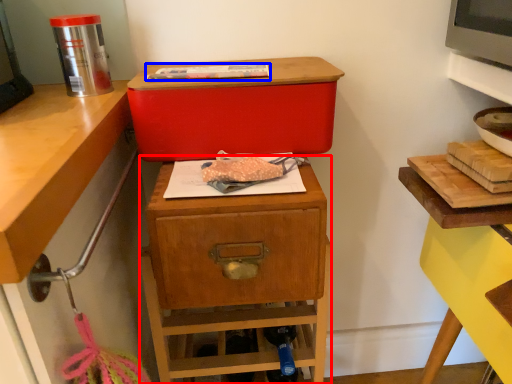
Question: Among these objects, which one is nearest to the camera, nightstand (highlighted by a red box) or food (highlighted by a blue box)?

Choices:
 (A) nightstand
 (B) food

Answer: (B)